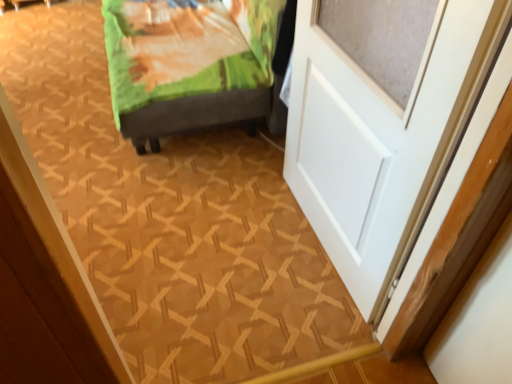
Locate an element on the screen. This screenshot has height=384, width=512. vacant space in front of white matte door at right is located at coordinates (291, 302).